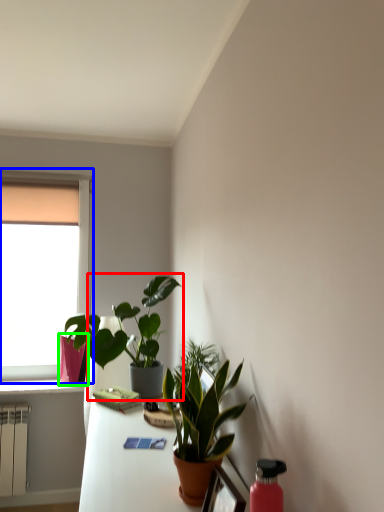
Question: Considering the real-world distances, which object is closest to houseplant (highlighted by a red box)? window (highlighted by a blue box) or flowerpot (highlighted by a green box).

Choices:
 (A) window
 (B) flowerpot

Answer: (B)